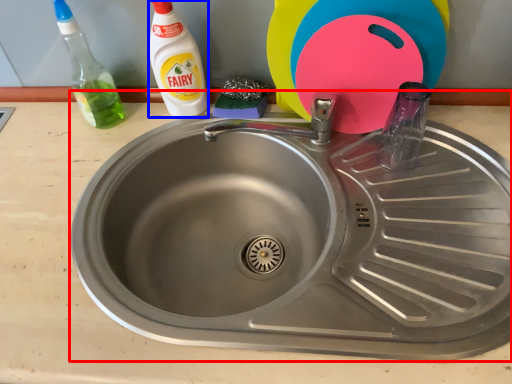
Question: Which object appears closest to the camera in this image, sink (highlighted by a red box) or cleaning product (highlighted by a blue box)?

Choices:
 (A) sink
 (B) cleaning product

Answer: (A)